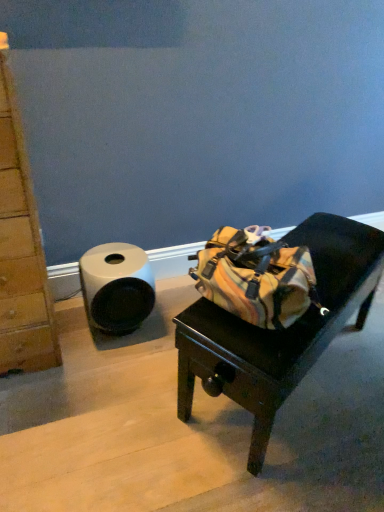
I want to click on blank space to the left of multicolored fabric bag at center, so click(114, 389).